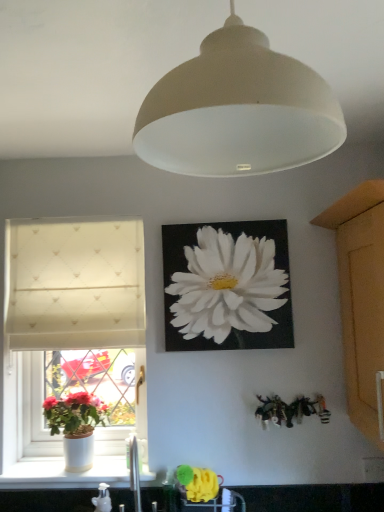
Locate an element on the screen. Image resolution: width=384 pixels, height=512 pixels. blank space above matte white pot at window (from a real-world perspective) is located at coordinates (83, 383).